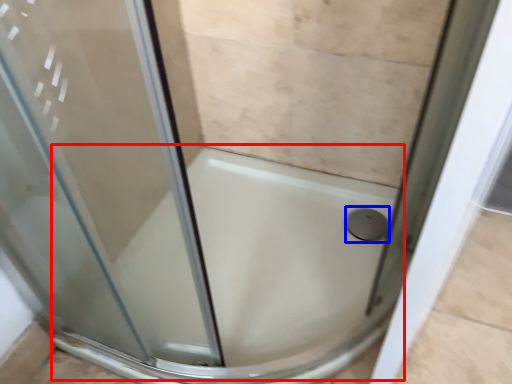
Question: Which of the following is the closest to the observer, bath (highlighted by a red box) or shower (highlighted by a blue box)?

Choices:
 (A) bath
 (B) shower

Answer: (A)